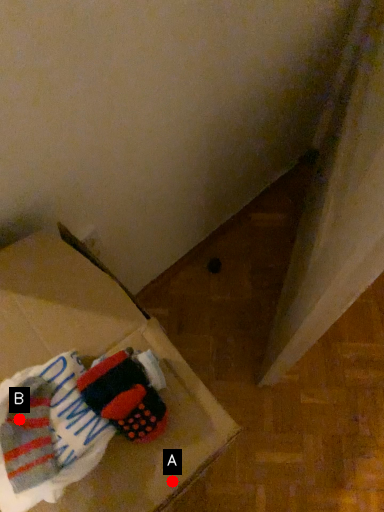
Question: Two points are circled on the image, labeled by A and B beside each circle. Among these points, which one is farthest from the camera?

Choices:
 (A) A is further
 (B) B is further

Answer: (A)